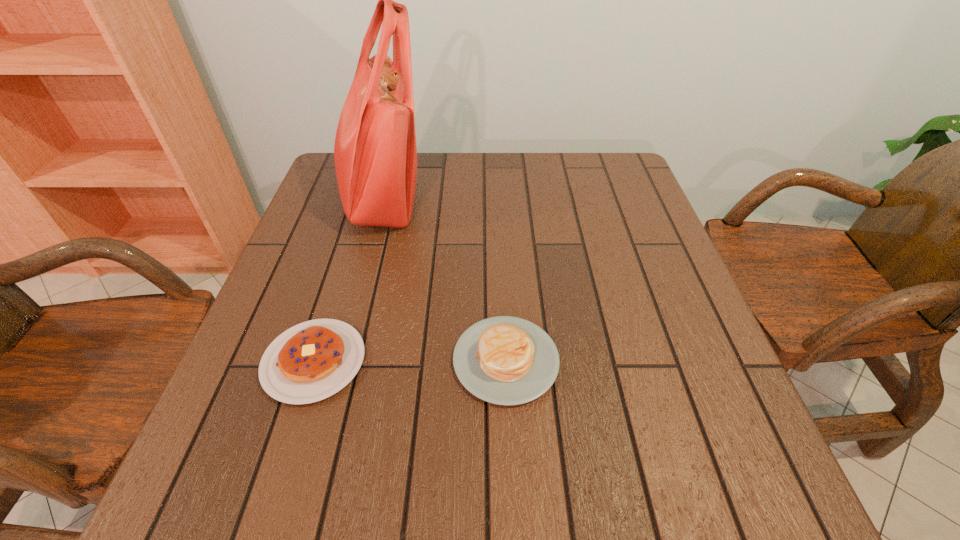
At what (x,y) coordinates should I click in order to perform the action: click on handbag. Please return your answer as a coordinate pair (x, y). The width and height of the screenshot is (960, 540). Looking at the image, I should click on (375, 152).

This screenshot has width=960, height=540. In order to click on the farthest object in this screenshot , I will do `click(375, 152)`.

You are a GUI agent. You are given a task and a screenshot of the screen. Output one action in this format:
    pyautogui.click(x=<x>, y=<y>)
    Task: Click on the right pancake
    
    Given the screenshot: What is the action you would take?
    click(x=504, y=360)

Identify the location of the rightmost object. (504, 360).

The height and width of the screenshot is (540, 960). Identify the location of the shortest object. (313, 360).

Identify the location of the left pancake. The image size is (960, 540). (313, 360).

Where is `free location located 0.330m on the front-facing side of the tallest object`? The height and width of the screenshot is (540, 960). free location located 0.330m on the front-facing side of the tallest object is located at coordinates (552, 197).

The height and width of the screenshot is (540, 960). Find the location of `vacant space located 0.210m on the right of the rightmost object`. vacant space located 0.210m on the right of the rightmost object is located at coordinates (673, 360).

The width and height of the screenshot is (960, 540). I want to click on blank space located 0.130m on the back of the shorter pancake, so (341, 276).

Locate an element on the screen. object located at the far edge is located at coordinates (375, 152).